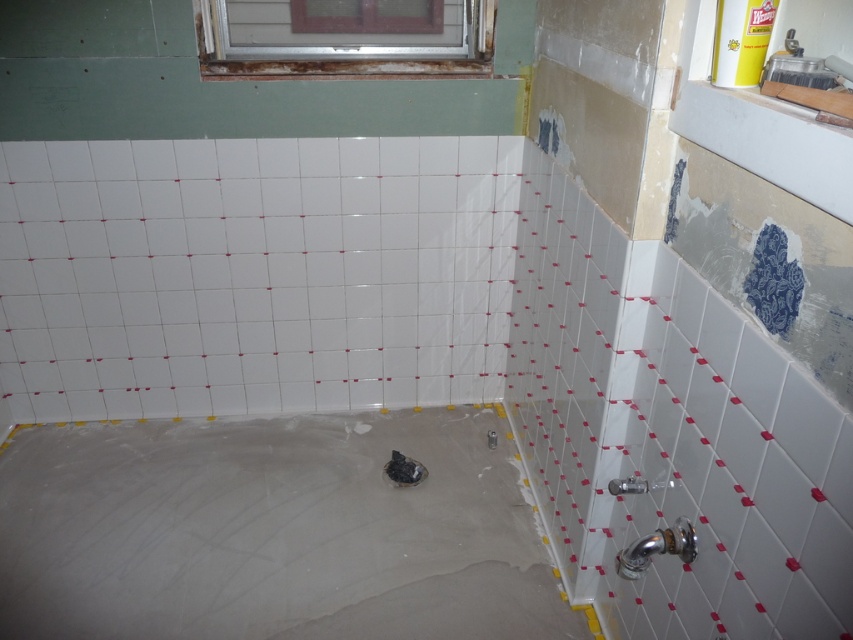
Question: Can you confirm if smooth concrete bathtub at lower left is positioned to the left of metallic silver window at upper center?

Choices:
 (A) yes
 (B) no

Answer: (A)

Question: Considering the relative positions of smooth concrete bathtub at lower left and metallic silver window at upper center in the image provided, where is smooth concrete bathtub at lower left located with respect to metallic silver window at upper center?

Choices:
 (A) right
 (B) left

Answer: (B)

Question: Can you confirm if smooth concrete bathtub at lower left is positioned to the left of metallic silver window at upper center?

Choices:
 (A) yes
 (B) no

Answer: (A)

Question: Among these points, which one is farthest from the camera?

Choices:
 (A) (286, 522)
 (B) (288, 4)

Answer: (A)

Question: Which point appears closest to the camera in this image?

Choices:
 (A) (364, 483)
 (B) (369, 35)

Answer: (B)